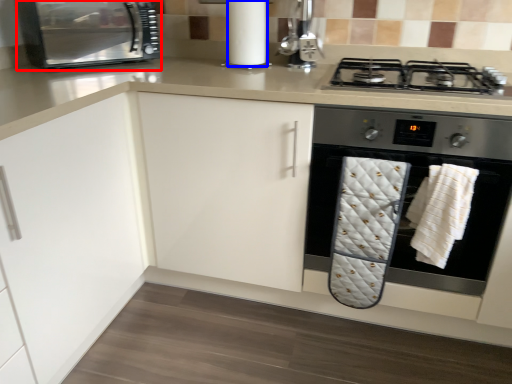
Question: Which point is further to the camera, kitchen appliance (highlighted by a red box) or paper towel (highlighted by a blue box)?

Choices:
 (A) kitchen appliance
 (B) paper towel

Answer: (B)